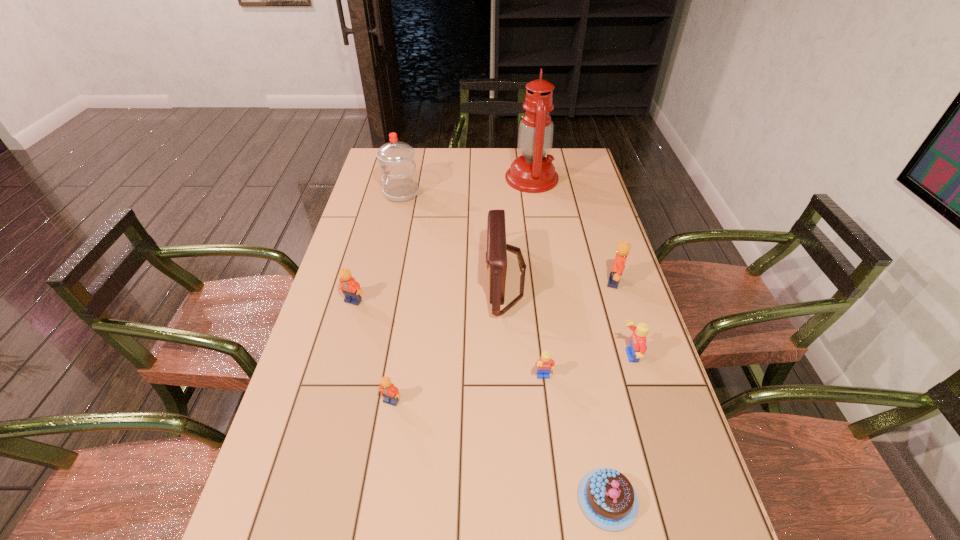
You are a GUI agent. You are given a task and a screenshot of the screen. Output one action in this format:
    pyautogui.click(x=<x>, y=<y>)
    Task: Click on the blank space located 0.330m on the face of the smaller yellow Lego
    This screenshot has height=540, width=960.
    Given the screenshot: What is the action you would take?
    pyautogui.click(x=564, y=539)

Identify the location of free space located on the back of the nearest object. 584,378.

You are a GUI agent. You are given a task and a screenshot of the screen. Output one action in this format:
    pyautogui.click(x=<x>, y=<y>)
    Task: Click on the object that is at the far edge
    This screenshot has height=540, width=960.
    Given the screenshot: What is the action you would take?
    pyautogui.click(x=532, y=172)

The width and height of the screenshot is (960, 540). Find the location of `water bottle at the left edge`. water bottle at the left edge is located at coordinates (396, 159).

Identify the location of Lego that is at the left edge. The image size is (960, 540). (351, 289).

Locate an element on the screen. This screenshot has width=960, height=540. oil lamp that is at the right edge is located at coordinates (532, 172).

You are a GUI agent. You are given a task and a screenshot of the screen. Output one action in this format:
    pyautogui.click(x=<x>, y=<y>)
    Task: Click on the chocolate cake that is positioned at the right edge
    This screenshot has width=960, height=540.
    Given the screenshot: What is the action you would take?
    pyautogui.click(x=607, y=498)

Locate an element on the screen. object located at the far right corner is located at coordinates (532, 172).

The image size is (960, 540). I want to click on free space at the far edge of the desktop, so click(x=483, y=164).

In the image, there is a desktop. What are the coordinates of `vacant region at the left edge` in the screenshot? It's located at (388, 206).